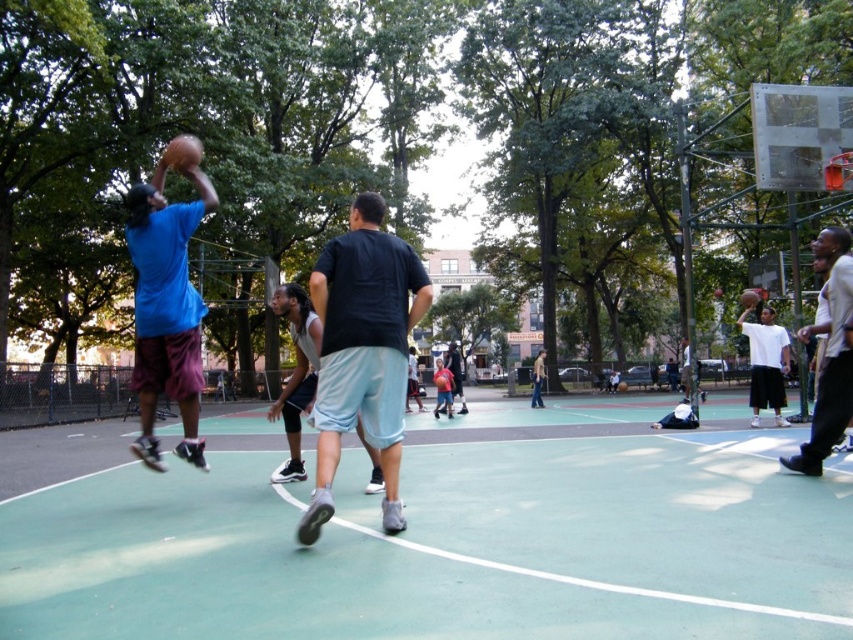
Question: Estimate the real-world distances between objects in this image. Which object is farther from the green rubber court at center?

Choices:
 (A) light brown leather jacket at center
 (B) light gray shorts at center

Answer: (A)

Question: Can you confirm if black matte shirt at center is positioned above light gray shorts at center?

Choices:
 (A) no
 (B) yes

Answer: (B)

Question: Does light gray shorts at center have a larger size compared to rubber textured basketball at center?

Choices:
 (A) no
 (B) yes

Answer: (B)

Question: Which of the following is the closest to the observer?

Choices:
 (A) (440, 365)
 (B) (773, 308)
 (C) (538, 358)
 (D) (445, 365)

Answer: (D)

Question: Is white cotton shirt at right to the right of light blue shorts at center from the viewer's perspective?

Choices:
 (A) no
 (B) yes

Answer: (B)

Question: Which of the following is the farthest from the observer?

Choices:
 (A) (459, 387)
 (B) (294, 461)
 (C) (158, 163)
 (D) (196, 150)

Answer: (C)